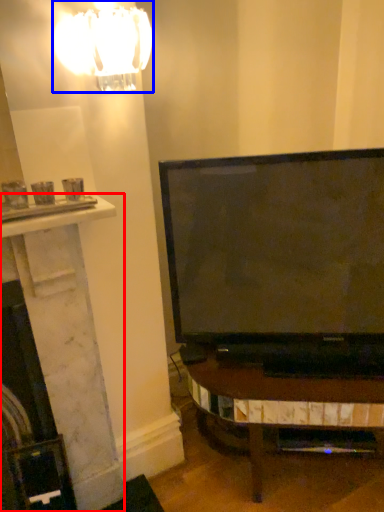
Question: Which point is further to the camera, fireplace (highlighted by a red box) or lamp (highlighted by a blue box)?

Choices:
 (A) fireplace
 (B) lamp

Answer: (A)